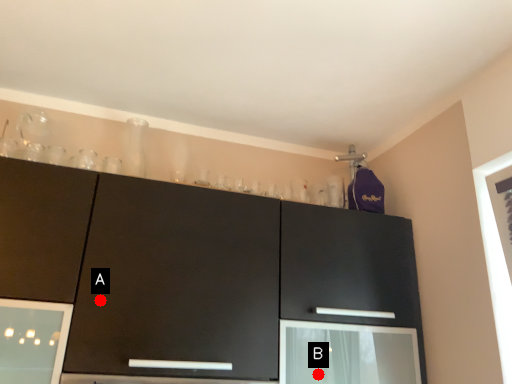
Question: Two points are circled on the image, labeled by A and B beside each circle. Which point is farther to the camera?

Choices:
 (A) A is further
 (B) B is further

Answer: (B)